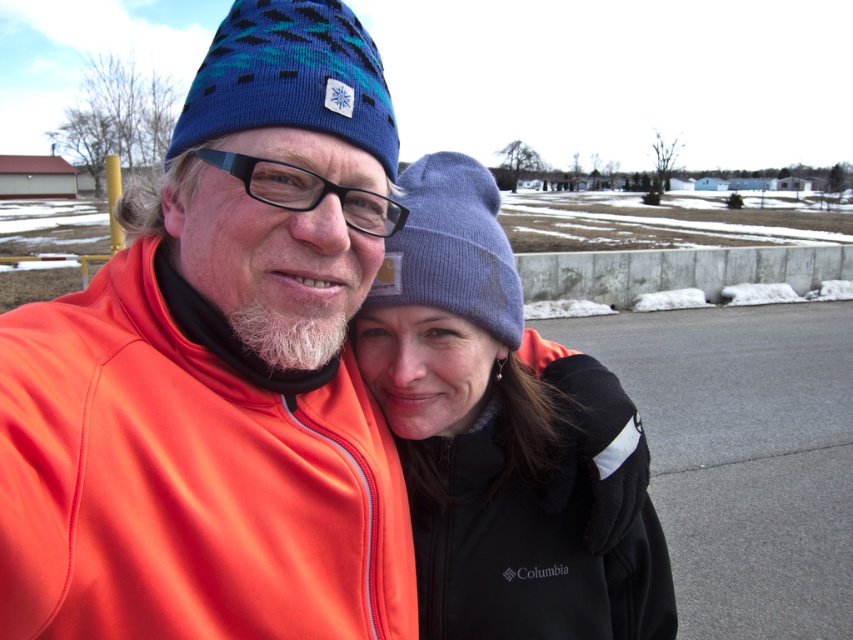
Question: Which point is farther from the camera taking this photo?

Choices:
 (A) (480, 490)
 (B) (242, 44)
 (C) (386, 276)
 (D) (337, 627)

Answer: (A)

Question: Does matte orange jacket at center appear over black fleece jacket at center?

Choices:
 (A) no
 (B) yes

Answer: (B)

Question: Which point is closer to the camera?

Choices:
 (A) (457, 257)
 (B) (265, 241)
 (C) (392, 164)

Answer: (B)

Question: Does blue knitted beanie at upper center appear over lavender knit beanie at center?

Choices:
 (A) no
 (B) yes

Answer: (B)

Question: Which point is farther from the camera taking this photo?

Choices:
 (A) (488, 266)
 (B) (384, 595)

Answer: (A)

Question: Does black fleece jacket at center have a larger size compared to lavender knit beanie at center?

Choices:
 (A) no
 (B) yes

Answer: (B)